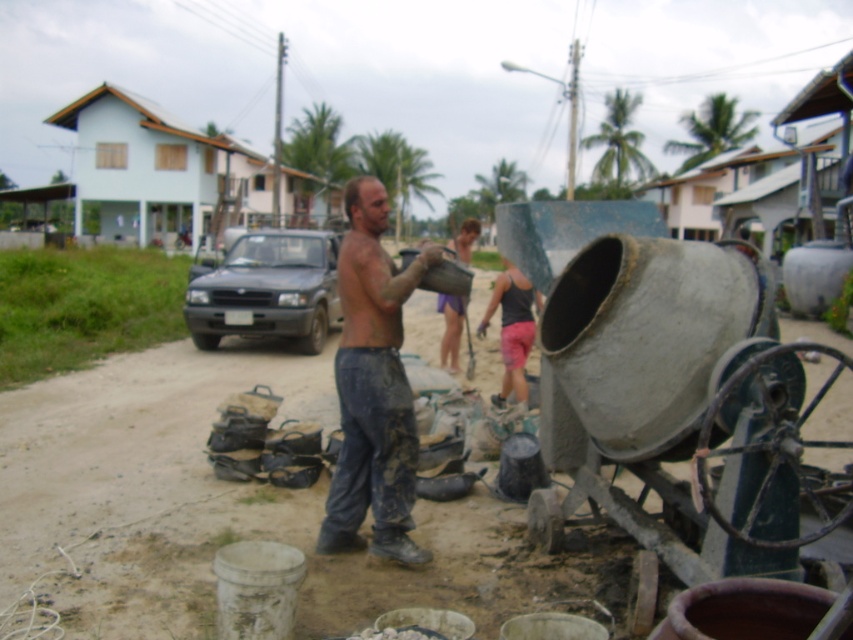
Is point (376, 426) positioned before point (451, 333)?

That is True.

Does muddy pants at center appear over purple fabric shorts at center?

Incorrect, muddy pants at center is not positioned above purple fabric shorts at center.

The height and width of the screenshot is (640, 853). Identify the location of muddy pants at center. (373, 387).

Locate an element on the screen. Image resolution: width=853 pixels, height=640 pixels. muddy pants at center is located at coordinates (373, 387).

Does dark gray matte truck at center-left have a greater height compared to purple fabric shorts at center?

Yes.

What do you see at coordinates (268, 291) in the screenshot? This screenshot has width=853, height=640. I see `dark gray matte truck at center-left` at bounding box center [268, 291].

Is point (308, 333) closer to camera compared to point (456, 371)?

No, (308, 333) is behind (456, 371).

At what (x,y) coordinates should I click in order to perform the action: click on dark gray matte truck at center-left. Please return your answer as a coordinate pair (x, y). The image size is (853, 640). Looking at the image, I should click on (268, 291).

Between point (393, 461) and point (508, 301), which one is positioned in front?

Point (393, 461) is more forward.

Can you confirm if muddy pants at center is bigger than dark gray tank top at center?

Indeed, muddy pants at center has a larger size compared to dark gray tank top at center.

I want to click on muddy pants at center, so tap(373, 387).